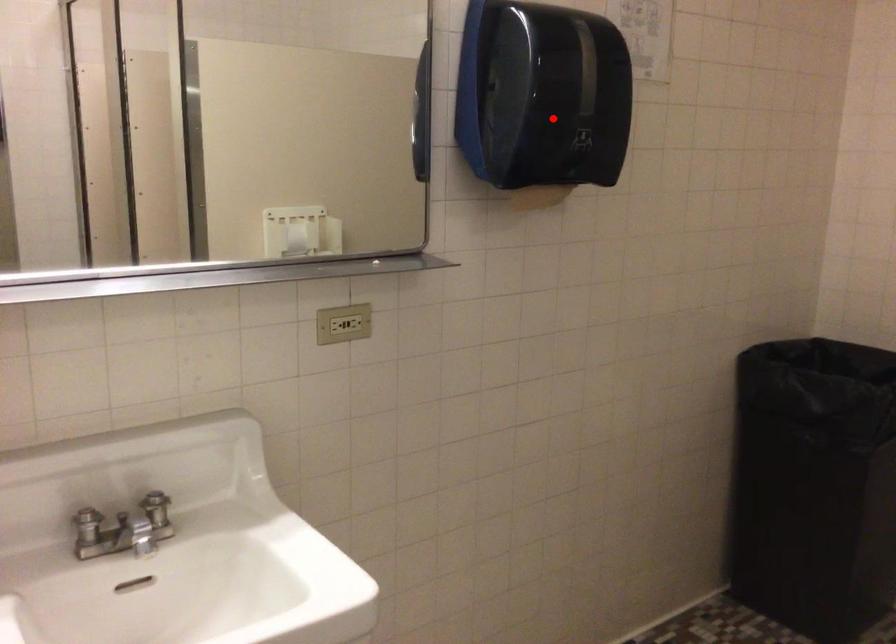
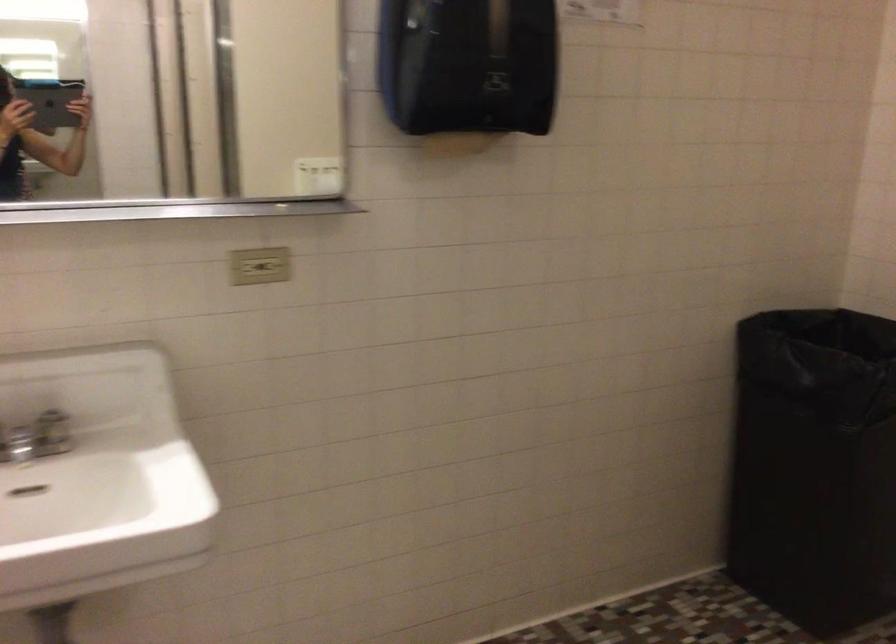
In the second image, find the point that corresponds to the highlighted location in the first image.

(468, 64)